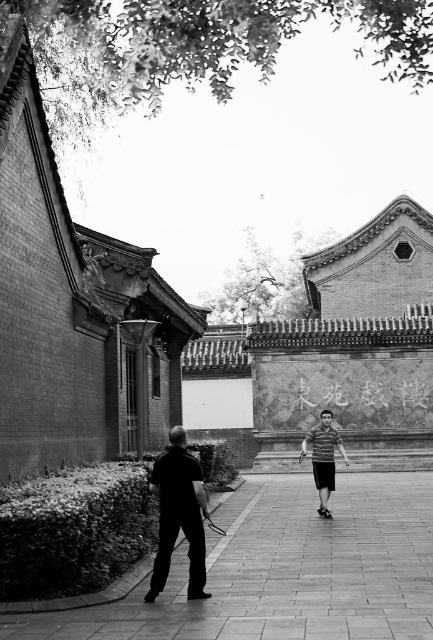
You are standing in the courtyard and see two people wearing dark gray fabric shirt at center and striped fabric shirt at center. Which one is positioned more to the left side?

The dark gray fabric shirt at center is positioned to the left of striped fabric shirt at center, so the dark gray fabric shirt at center is more to the left side.

You are standing in the courtyard and want to place a small potted plant on the smooth concrete pavement at lower left. However, there is a dark gray fabric shirt at center in the way. Can you move the shirt to access the pavement?

The smooth concrete pavement at lower left is located below the dark gray fabric shirt at center, meaning the shirt is blocking access to the pavement. You would need to move the shirt to place the plant there.

You are standing in the courtyard and want to greet both people wearing the dark gray fabric shirt at center and the striped fabric shirt at center. Which one should you approach first to greet them in the order they are positioned?

You should first approach the dark gray fabric shirt at center because it is closer to you than the striped fabric shirt at center.